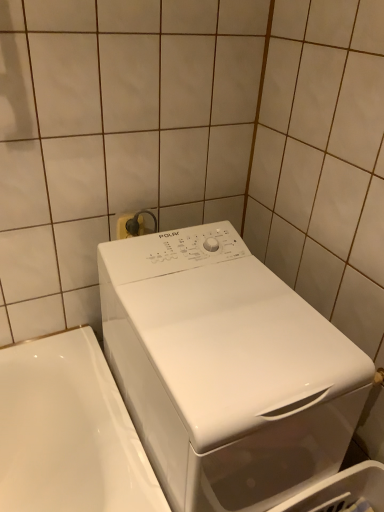
Question: Is white plastic electric outlet at upper center positioned with its back to white glossy washing machine at center?

Choices:
 (A) no
 (B) yes

Answer: (A)

Question: Considering the relative positions of white plastic electric outlet at upper center and white glossy washing machine at center in the image provided, is white plastic electric outlet at upper center to the right of white glossy washing machine at center from the viewer's perspective?

Choices:
 (A) yes
 (B) no

Answer: (B)

Question: From a real-world perspective, is white plastic electric outlet at upper center on white glossy washing machine at center?

Choices:
 (A) yes
 (B) no

Answer: (A)

Question: Can you confirm if white plastic electric outlet at upper center is thinner than white glossy washing machine at center?

Choices:
 (A) yes
 (B) no

Answer: (A)

Question: Is white plastic electric outlet at upper center smaller than white glossy washing machine at center?

Choices:
 (A) yes
 (B) no

Answer: (A)

Question: Is white plastic electric outlet at upper center touching white glossy washing machine at center?

Choices:
 (A) yes
 (B) no

Answer: (B)

Question: Considering the relative positions of white glossy washing machine at center and white plastic electric outlet at upper center in the image provided, is white glossy washing machine at center to the left of white plastic electric outlet at upper center from the viewer's perspective?

Choices:
 (A) yes
 (B) no

Answer: (B)

Question: Does white glossy washing machine at center come behind white plastic electric outlet at upper center?

Choices:
 (A) no
 (B) yes

Answer: (A)

Question: Considering the relative sizes of white glossy washing machine at center and white plastic electric outlet at upper center in the image provided, is white glossy washing machine at center taller than white plastic electric outlet at upper center?

Choices:
 (A) no
 (B) yes

Answer: (B)

Question: Is white glossy washing machine at center in front of white plastic electric outlet at upper center?

Choices:
 (A) no
 (B) yes

Answer: (B)

Question: Is white glossy washing machine at center not within white plastic electric outlet at upper center?

Choices:
 (A) no
 (B) yes

Answer: (B)

Question: Is white glossy washing machine at center wider than white plastic electric outlet at upper center?

Choices:
 (A) no
 (B) yes

Answer: (B)

Question: Would you say white plastic electric outlet at upper center is to the left or to the right of white glossy washing machine at center in the picture?

Choices:
 (A) right
 (B) left

Answer: (B)